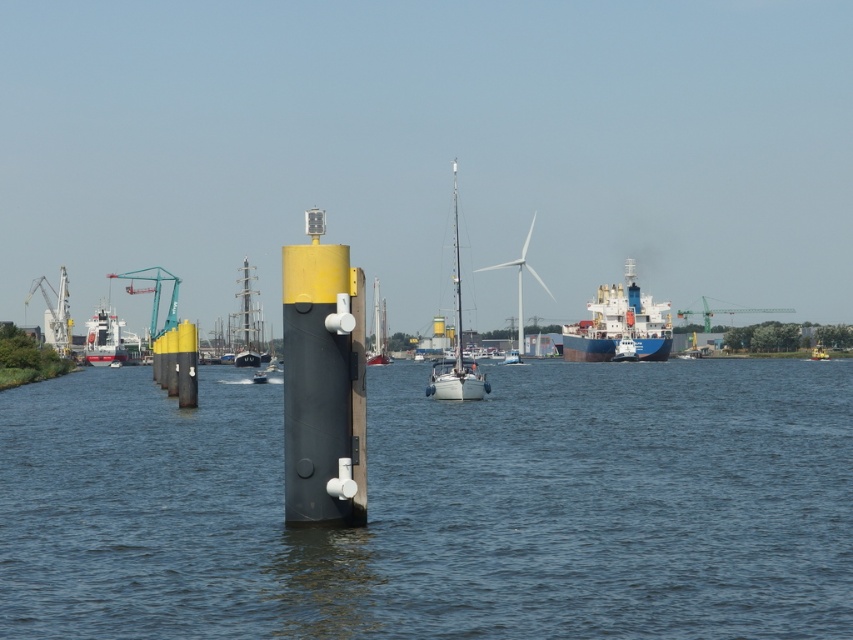
Does black matte post at center appear under red sailboat at center?

Yes.

From the picture: Can you confirm if black matte post at center is wider than red sailboat at center?

Yes.

Does point (426, 536) come closer to viewer compared to point (374, 291)?

That is True.

This screenshot has width=853, height=640. I want to click on black matte post at center, so click(x=438, y=508).

Which is below, white matte sailboat at center or green metallic crane at upper right?

green metallic crane at upper right

Is white matte sailboat at center to the left of green metallic crane at upper right from the viewer's perspective?

Correct, you'll find white matte sailboat at center to the left of green metallic crane at upper right.

Does point (444, 358) come behind point (728, 308)?

No, (444, 358) is in front of (728, 308).

Locate an element on the screen. The width and height of the screenshot is (853, 640). white matte sailboat at center is located at coordinates (456, 342).

Between point (369, 348) and point (792, 308), which one is positioned in front?

Point (369, 348) is more forward.

Who is higher up, red sailboat at center or green metallic crane at upper right?

green metallic crane at upper right

The height and width of the screenshot is (640, 853). In order to click on red sailboat at center in this screenshot , I will do `click(378, 330)`.